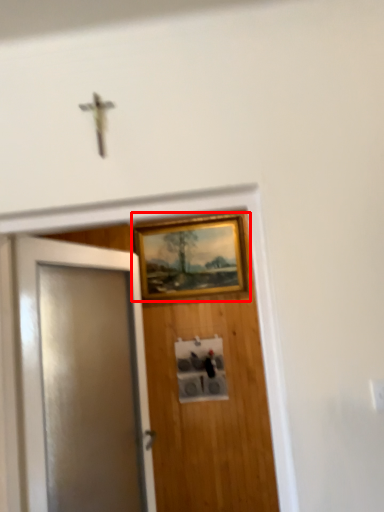
Question: From the image's perspective, what is the correct spatial relationship of picture frame (annotated by the red box) in relation to door?

Choices:
 (A) below
 (B) above

Answer: (B)